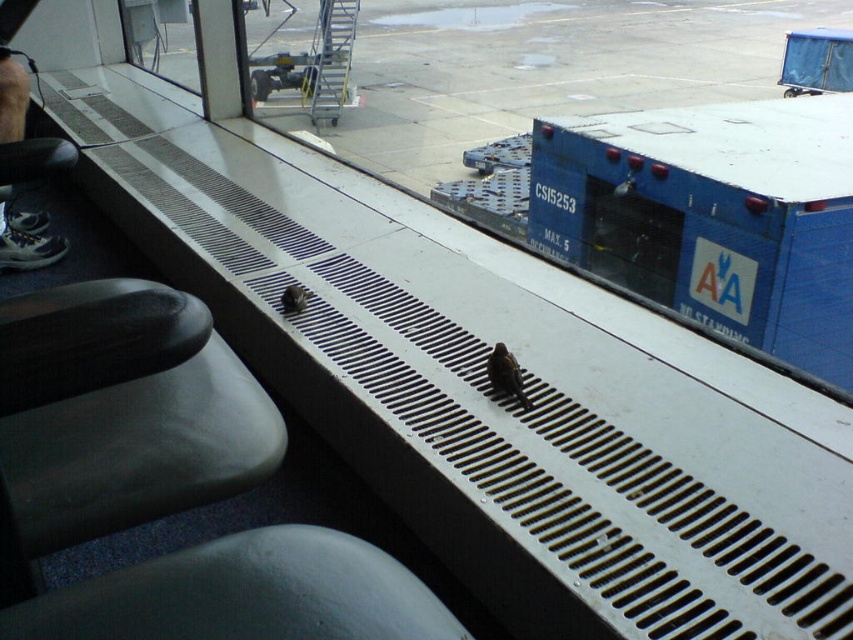
Can you confirm if leather shoe at left is shorter than transparent glass window at upper left?

Yes.

Is leather shoe at left to the right of transparent glass window at upper left from the viewer's perspective?

Indeed, leather shoe at left is positioned on the right side of transparent glass window at upper left.

Which is behind, point (7, 100) or point (123, 29)?

The point (123, 29) is more distant.

At what (x,y) coordinates should I click in order to perform the action: click on leather shoe at left. Please return your answer as a coordinate pair (x, y). Looking at the image, I should click on (27, 241).

Does blue matte cargo container at center have a larger size compared to transparent glass window at upper left?

Actually, blue matte cargo container at center might be smaller than transparent glass window at upper left.

From the picture: Can you confirm if blue matte cargo container at center is smaller than transparent glass window at upper left?

Yes, blue matte cargo container at center is smaller than transparent glass window at upper left.

Is point (631, 220) behind point (131, 19)?

No, it is in front of (131, 19).

Locate an element on the screen. blue matte cargo container at center is located at coordinates (631, 237).

Which is more to the right, smooth gray seat at lower left or leather shoe at left?

smooth gray seat at lower left

Can you confirm if smooth gray seat at lower left is positioned below leather shoe at left?

Correct, smooth gray seat at lower left is located below leather shoe at left.

Is point (173, 557) positioned after point (22, 81)?

That is False.

Find the location of a particular element. smooth gray seat at lower left is located at coordinates (245, 595).